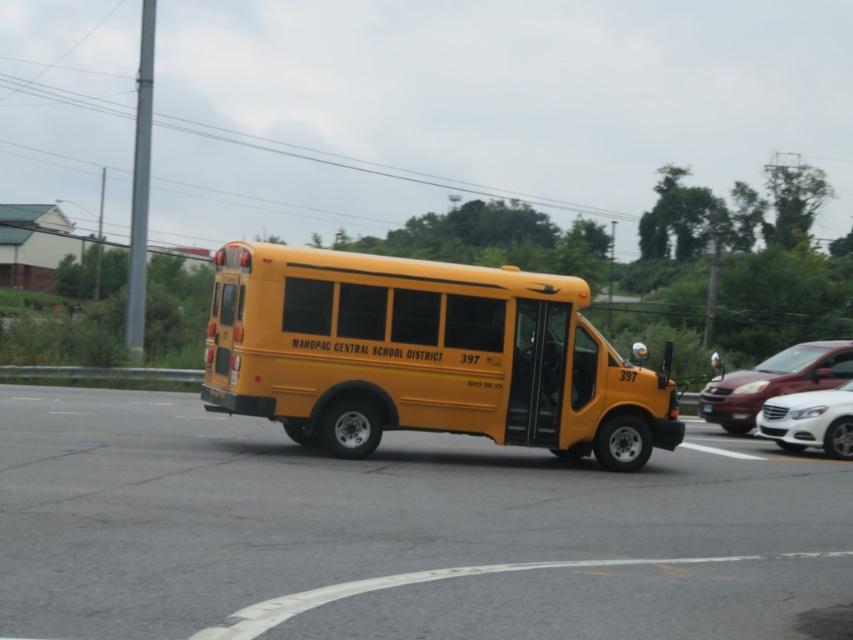
Is matte white sedan at right positioned before white glossy sedan at center?

No, it is not.

Does matte white sedan at right have a greater width compared to white glossy sedan at center?

Yes, matte white sedan at right is wider than white glossy sedan at center.

Identify the location of matte white sedan at right. The image size is (853, 640). (775, 381).

The image size is (853, 640). I want to click on matte white sedan at right, so click(x=775, y=381).

Between yellow matte school bus at center and white glossy sedan at center, which one is positioned higher?

yellow matte school bus at center

At what (x,y) coordinates should I click in order to perform the action: click on yellow matte school bus at center. Please return your answer as a coordinate pair (x, y). This screenshot has height=640, width=853. Looking at the image, I should click on (426, 355).

Is yellow matte school bus at center above matte white sedan at right?

Correct, yellow matte school bus at center is located above matte white sedan at right.

I want to click on yellow matte school bus at center, so pyautogui.click(x=426, y=355).

You are a GUI agent. You are given a task and a screenshot of the screen. Output one action in this format:
    pyautogui.click(x=<x>, y=<y>)
    Task: Click on the yellow matte school bus at center
    This screenshot has width=853, height=640.
    Given the screenshot: What is the action you would take?
    pyautogui.click(x=426, y=355)